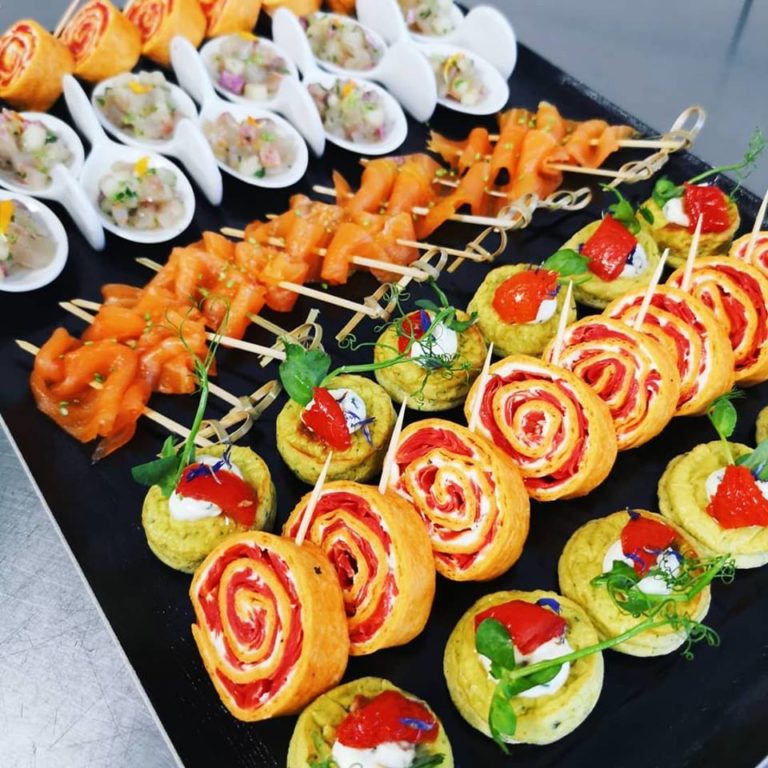
The image size is (768, 768). Identify the location of counter top. (65, 664).